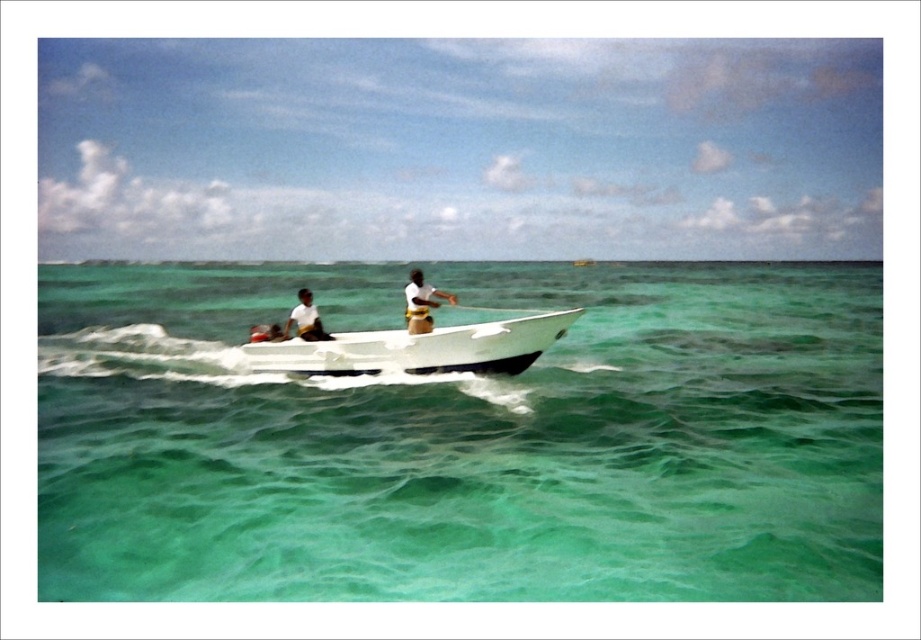
Is white glossy boat at center to the left of white matte shirt at center from the viewer's perspective?

No, white glossy boat at center is not to the left of white matte shirt at center.

Who is higher up, white glossy boat at center or white matte shirt at center?

white matte shirt at center is higher up.

Who is more distant from viewer, [429,342] or [306,300]?

Positioned behind is point [306,300].

What are the coordinates of `white glossy boat at center` in the screenshot? It's located at (417, 348).

Is clear green water at center wider than white matte shirt at center?

Yes.

Is point (357, 570) positioned before point (284, 337)?

Yes, it is in front of point (284, 337).

Between point (79, 348) and point (301, 301), which one is positioned in front?

Positioned in front is point (301, 301).

The height and width of the screenshot is (640, 921). In order to click on clear green water at center in this screenshot , I will do `click(465, 440)`.

Which of these two, white glossy boat at center or white matte life vest at center, stands shorter?

With less height is white glossy boat at center.

Which is behind, point (475, 364) or point (434, 288)?

The point (434, 288) is behind.

This screenshot has height=640, width=921. I want to click on white glossy boat at center, so click(x=417, y=348).